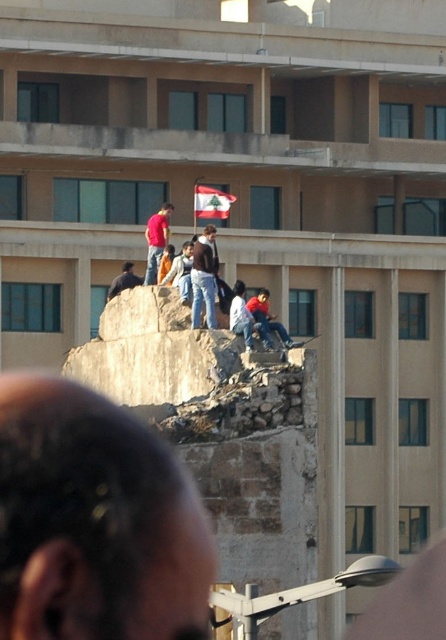
Between point (170, 460) and point (124, 278), which one is positioned behind?

The point (124, 278) is more distant.

Is point (190, 632) positioned before point (123, 282)?

Yes, it is in front of point (123, 282).

Is point (168, 460) less distant than point (123, 284)?

Yes.

This screenshot has width=446, height=640. Find the location of `bald head at center`. bald head at center is located at coordinates (94, 522).

Is the position of matte red shirt at center more distant than that of white fabric flag at center?

No.

At what (x,y) coordinates should I click in order to perform the action: click on matte red shirt at center. Please return your answer as a coordinate pair (x, y). Looking at the image, I should click on (156, 241).

Is bald head at center smaller than white fabric flag at center?

Actually, bald head at center might be larger than white fabric flag at center.

Which of these two, bald head at center or white fabric flag at center, stands taller?

Standing taller between the two is bald head at center.

This screenshot has width=446, height=640. What do you see at coordinates (94, 522) in the screenshot?
I see `bald head at center` at bounding box center [94, 522].

Where is `bald head at center`? bald head at center is located at coordinates (94, 522).